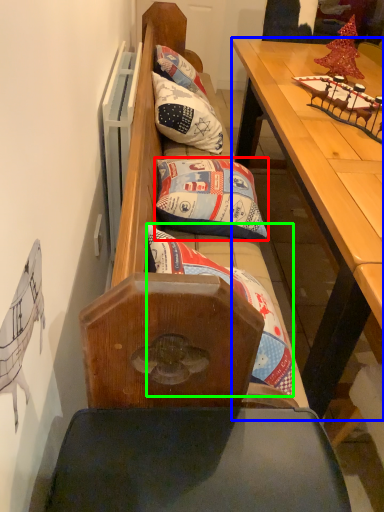
Question: Which is farther away from pillow (highlighted by a red box)? table (highlighted by a blue box) or pillow (highlighted by a green box)?

Choices:
 (A) table
 (B) pillow

Answer: (A)